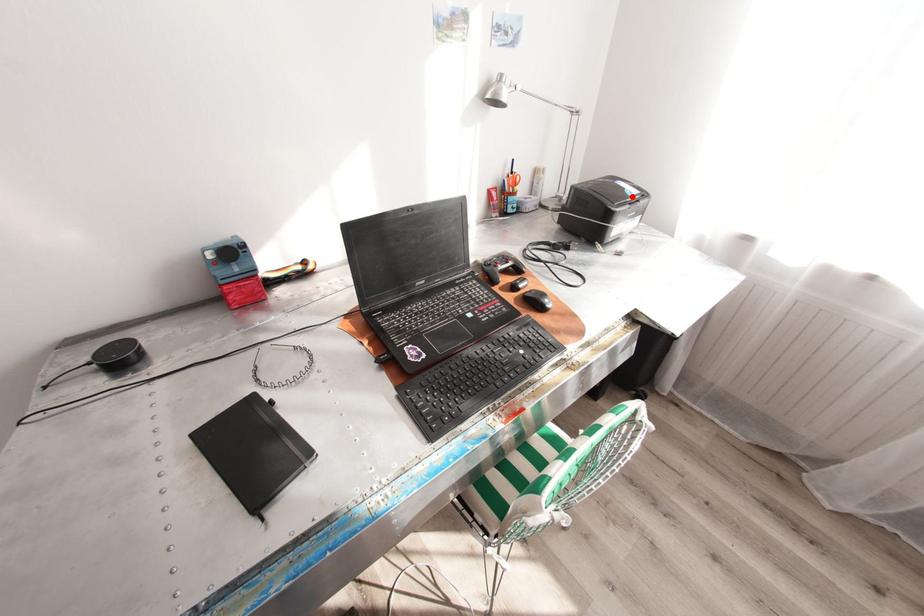
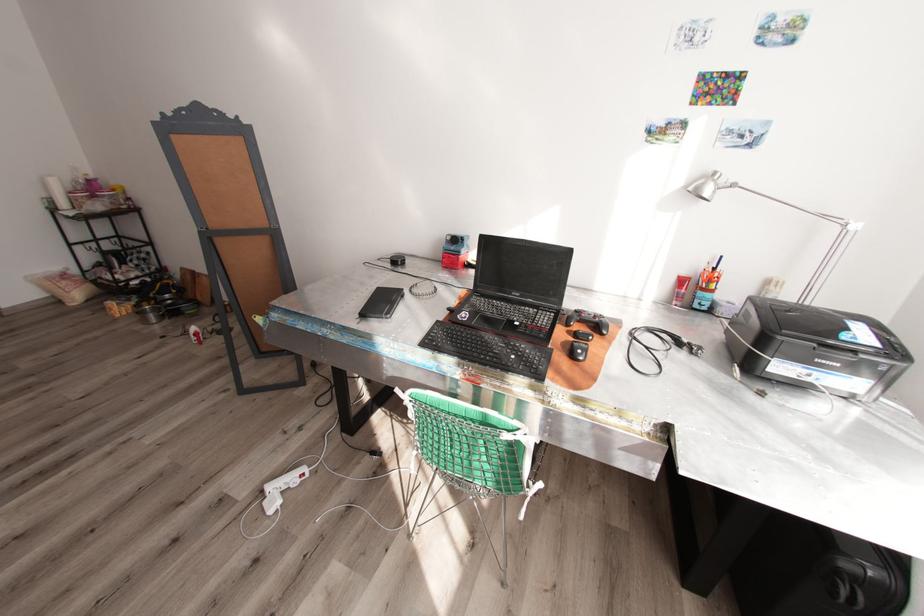
Find the pixel in the second image that matches the highlighted location in the first image.

(841, 338)